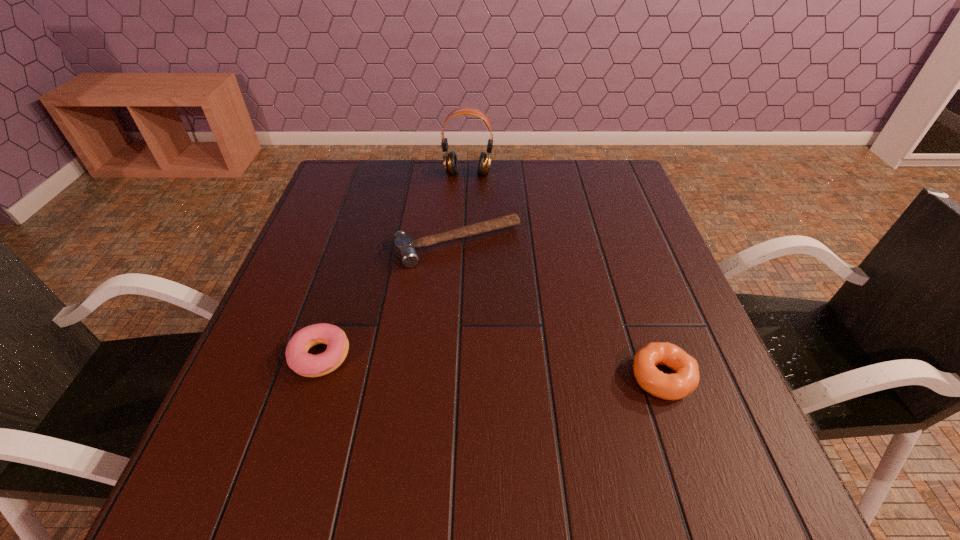
Locate an element on the screen. The image size is (960, 540). free space located on the striking face of the shortest object is located at coordinates (516, 325).

You are a GUI agent. You are given a task and a screenshot of the screen. Output one action in this format:
    pyautogui.click(x=<x>, y=<y>)
    Task: Click on the vacant space situated 0.090m on the ear cups of the tallest object
    
    Given the screenshot: What is the action you would take?
    pyautogui.click(x=465, y=197)

Identify the location of blank space located 0.330m on the ear cups of the tallest object. Image resolution: width=960 pixels, height=540 pixels. (457, 251).

I want to click on vacant region located on the ear cups of the tallest object, so click(462, 215).

Where is `object at the far edge`? The height and width of the screenshot is (540, 960). object at the far edge is located at coordinates (450, 160).

Find the location of a particular element. object present at the near edge is located at coordinates (679, 385).

Locate an element on the screen. object situated at the left edge is located at coordinates (308, 365).

Where is `object that is at the right edge`? The width and height of the screenshot is (960, 540). object that is at the right edge is located at coordinates (679, 385).

Where is `object located at the near right corner`? This screenshot has width=960, height=540. object located at the near right corner is located at coordinates (679, 385).

The image size is (960, 540). What are the coordinates of `free space at the far edge of the desktop` in the screenshot? It's located at (514, 202).